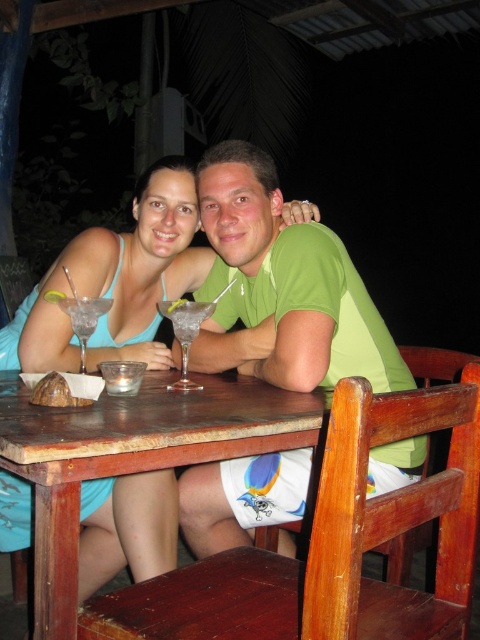
Question: Based on their relative distances, which object is farther from the wooden table at center?

Choices:
 (A) clear glass martini at table left
 (B) green matte shirt at center

Answer: (B)

Question: Does green matte shirt at center appear on the left side of wooden table at center?

Choices:
 (A) no
 (B) yes

Answer: (A)

Question: Is the position of green matte shirt at center less distant than that of wooden table at center?

Choices:
 (A) no
 (B) yes

Answer: (A)

Question: Is green matte shirt at center closer to camera compared to clear glass martini at table left?

Choices:
 (A) yes
 (B) no

Answer: (B)

Question: Which of the following is the farthest from the observer?

Choices:
 (A) wooden table at center
 (B) clear glass martini at table left

Answer: (B)

Question: Which object appears farthest from the camera in this image?

Choices:
 (A) clear glass martini at table left
 (B) green matte shirt at center

Answer: (B)